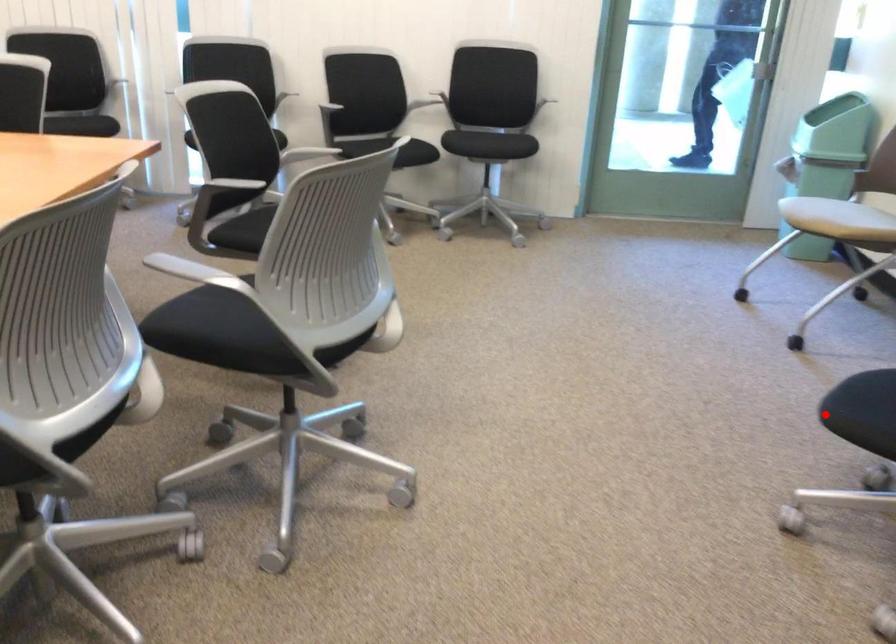
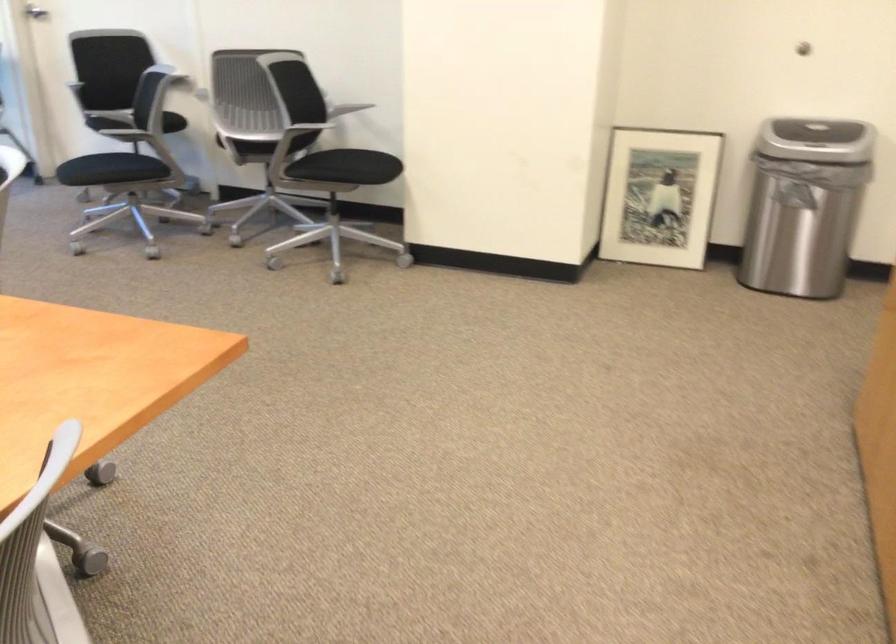
Question: I am providing you with two images of the same scene from different viewpoints. A red point is marked on the first image. Is the red point's position out of view in image 2?

Choices:
 (A) Yes
 (B) No

Answer: (B)